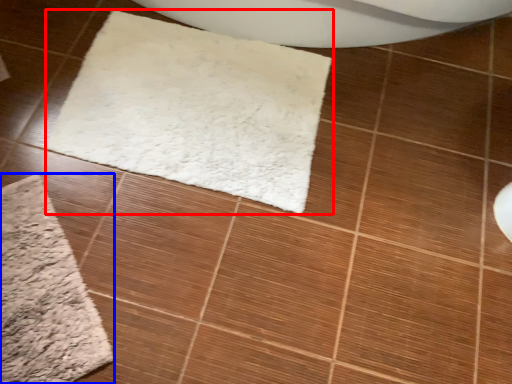
Question: Which object is closer to the camera taking this photo, mat (highlighted by a red box) or bath mat (highlighted by a blue box)?

Choices:
 (A) mat
 (B) bath mat

Answer: (B)